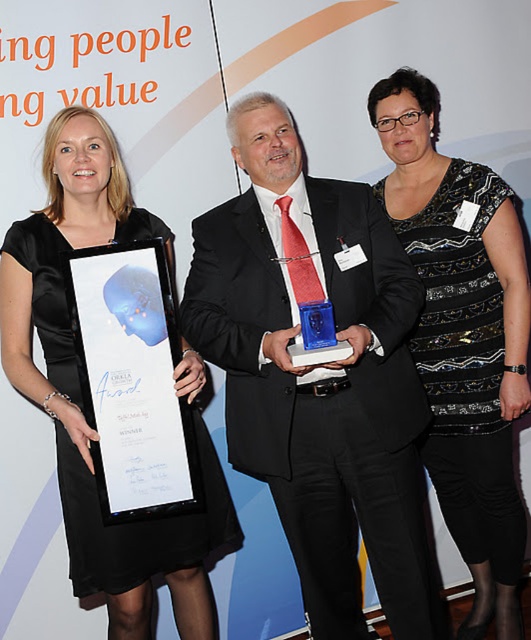
Question: Considering the real-world distances, which object is closest to the white paper at left?

Choices:
 (A) matte black suit at center
 (B) black sequined dress at center

Answer: (A)

Question: Can you confirm if matte black suit at center is positioned above black sequined dress at center?

Choices:
 (A) no
 (B) yes

Answer: (A)

Question: Can you confirm if black sequined dress at center is bigger than satin black dress at left?

Choices:
 (A) no
 (B) yes

Answer: (A)

Question: Among these points, which one is farthest from the camera?

Choices:
 (A) (487, 477)
 (B) (272, 115)
 (C) (124, 419)
 (D) (64, 440)

Answer: (A)

Question: Is black sequined dress at center thinner than white paper at left?

Choices:
 (A) no
 (B) yes

Answer: (A)

Question: Which object is positioned farthest from the matte black suit at center?

Choices:
 (A) white paper at left
 (B) satin black dress at left

Answer: (B)